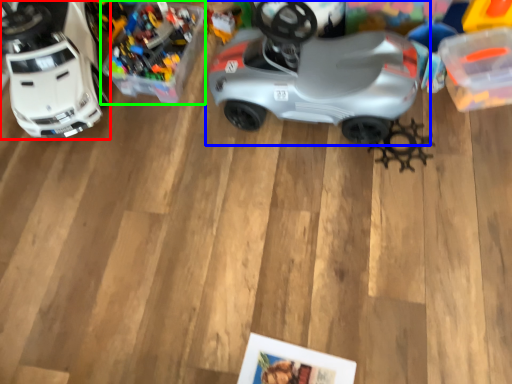
Question: Based on their relative distances, which object is nearer to toy (highlighted by a red box)? Choose from car (highlighted by a blue box) and toy (highlighted by a green box).

Choices:
 (A) car
 (B) toy

Answer: (B)